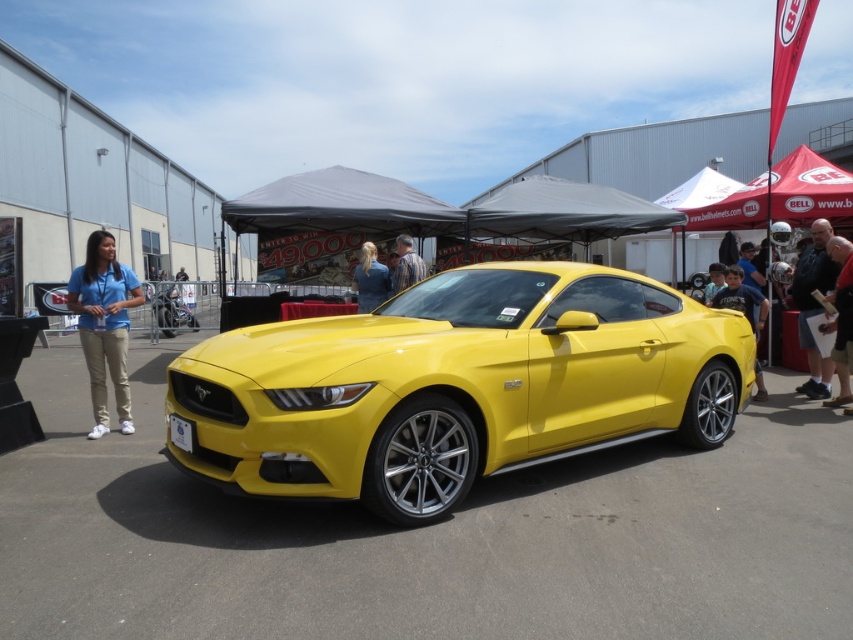
You are standing in front of the yellow Ford Mustang GT at the car show. There is a reddish brown leather jacket at right located at point (840, 317). Can you see the jacket from where you are standing?

The reddish brown leather jacket at right is located at point (840, 317), so yes, you can see it from where you are standing in front of the yellow Ford Mustang GT.